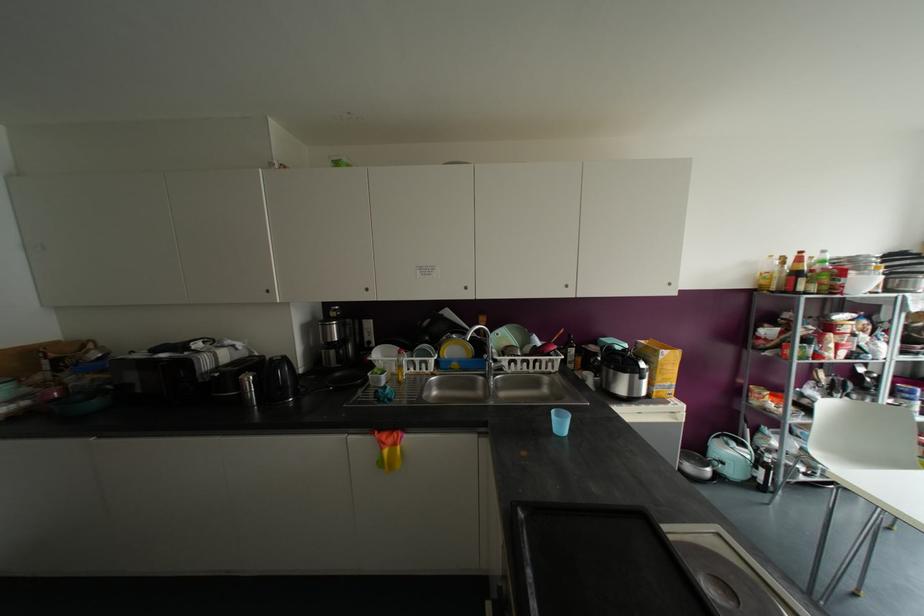
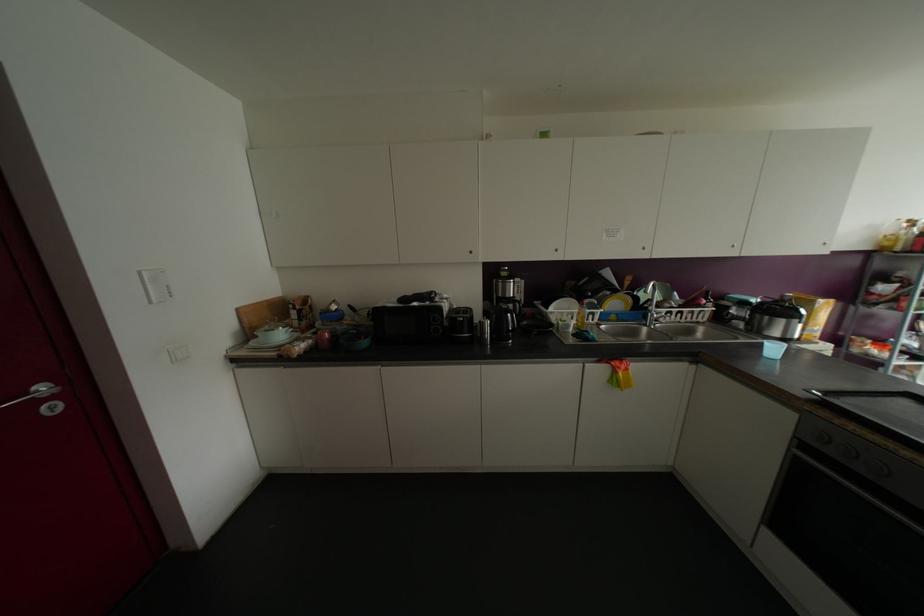
Find the pixel in the second image that matches the point at 454,349 in the first image.

(614, 302)